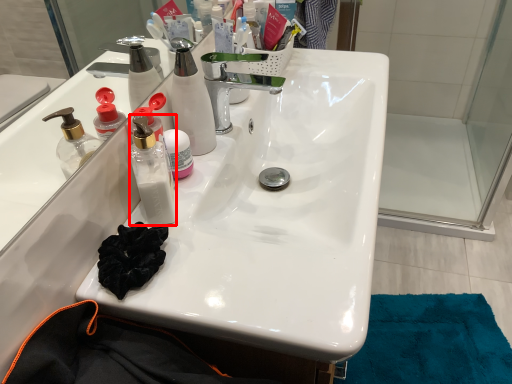
Question: From the image's perspective, considering the relative positions of bottle (annotated by the red box) and bottle in the image provided, where is bottle (annotated by the red box) located with respect to the staircase?

Choices:
 (A) above
 (B) below

Answer: (B)